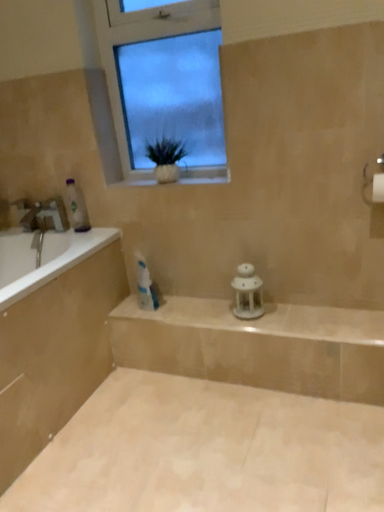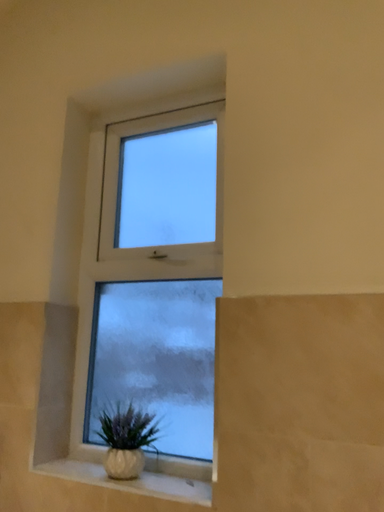
Question: Which way did the camera rotate in the video?

Choices:
 (A) rotated downward
 (B) rotated upward

Answer: (B)